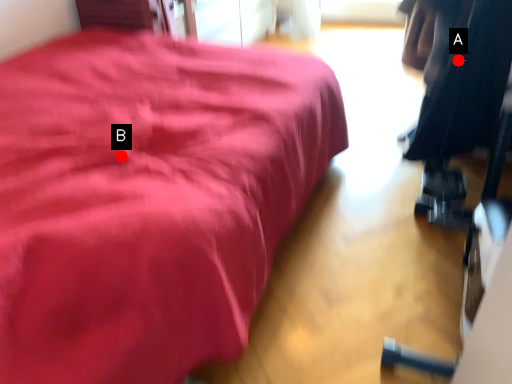
Question: Two points are circled on the image, labeled by A and B beside each circle. Which point is farther from the camera taking this photo?

Choices:
 (A) A is further
 (B) B is further

Answer: (A)